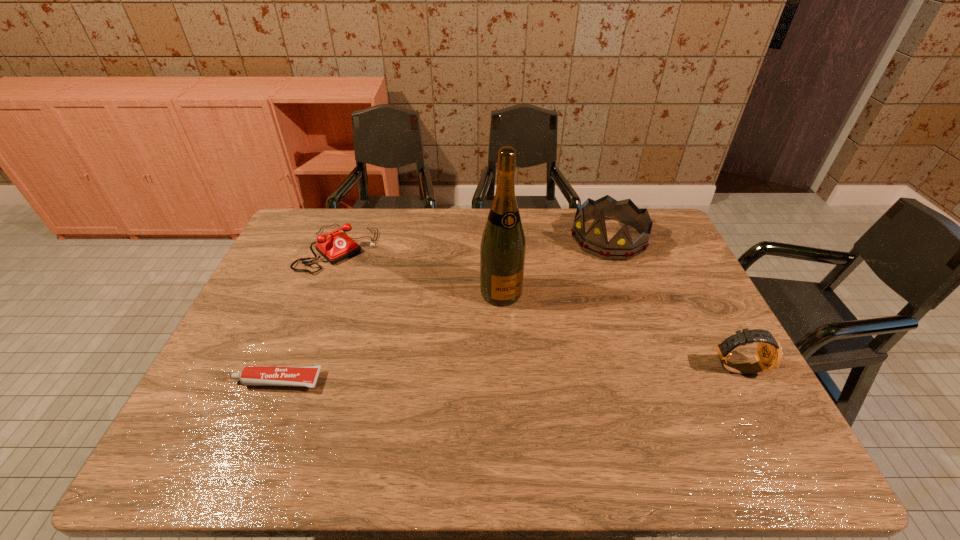
Identify the location of vacant position at the right edge of the desktop. (670, 304).

At what (x,y) coordinates should I click in order to perform the action: click on vacant space at the far left corner. Please return your answer as a coordinate pair (x, y). The height and width of the screenshot is (540, 960). Looking at the image, I should click on (326, 227).

Where is `free space between the telephone and the shortest object`? The height and width of the screenshot is (540, 960). free space between the telephone and the shortest object is located at coordinates (308, 315).

In order to click on unoccupied position between the telephone and the third tallest object in this screenshot , I will do `click(537, 308)`.

You are a GUI agent. You are given a task and a screenshot of the screen. Output one action in this format:
    pyautogui.click(x=<x>, y=<y>)
    Task: Click on the vacant space that is in between the third object from left to right and the second shortest object
    
    Given the screenshot: What is the action you would take?
    pyautogui.click(x=420, y=271)

Image resolution: width=960 pixels, height=540 pixels. I want to click on empty location between the third farthest object and the second object from right to left, so click(555, 266).

Where is `free space that is in between the second tallest object and the rightmost object`? Image resolution: width=960 pixels, height=540 pixels. free space that is in between the second tallest object and the rightmost object is located at coordinates (672, 303).

Where is `unoccupied position between the rightmost object and the fourth shortest object`? The width and height of the screenshot is (960, 540). unoccupied position between the rightmost object and the fourth shortest object is located at coordinates (672, 303).

Image resolution: width=960 pixels, height=540 pixels. In order to click on free point between the second object from right to left and the shortest object in this screenshot , I will do `click(444, 310)`.

At what (x,y) coordinates should I click in order to perform the action: click on free space between the wine bottle and the second object from right to left. Please return your answer as a coordinate pair (x, y). The height and width of the screenshot is (540, 960). Looking at the image, I should click on (555, 266).